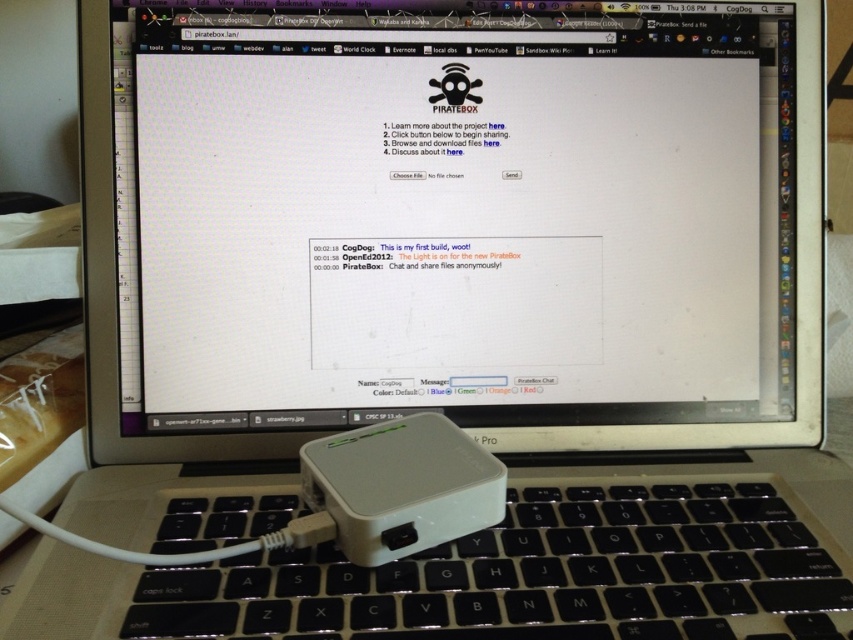
Question: Which point is farther from the camera taking this photo?

Choices:
 (A) (442, 540)
 (B) (718, 616)

Answer: (A)

Question: Can you confirm if black plastic keyboard at lower center is wider than white plastic ipod at center?

Choices:
 (A) yes
 (B) no

Answer: (A)

Question: Is black plastic keyboard at lower center above white plastic ipod at center?

Choices:
 (A) yes
 (B) no

Answer: (B)

Question: Does black plastic keyboard at lower center appear under white plastic ipod at center?

Choices:
 (A) no
 (B) yes

Answer: (B)

Question: Which object is farther from the camera taking this photo?

Choices:
 (A) white plastic ipod at center
 (B) black plastic keyboard at lower center

Answer: (A)